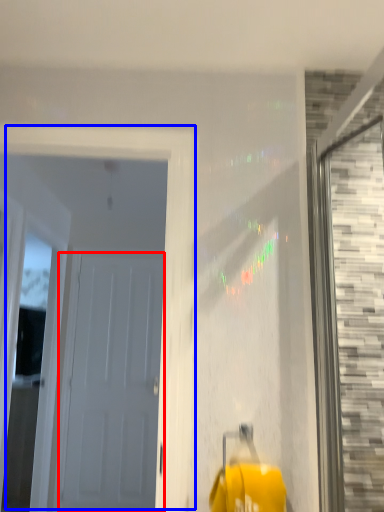
Question: Among these objects, which one is nearest to the camera, door (highlighted by a red box) or door (highlighted by a blue box)?

Choices:
 (A) door
 (B) door

Answer: (B)